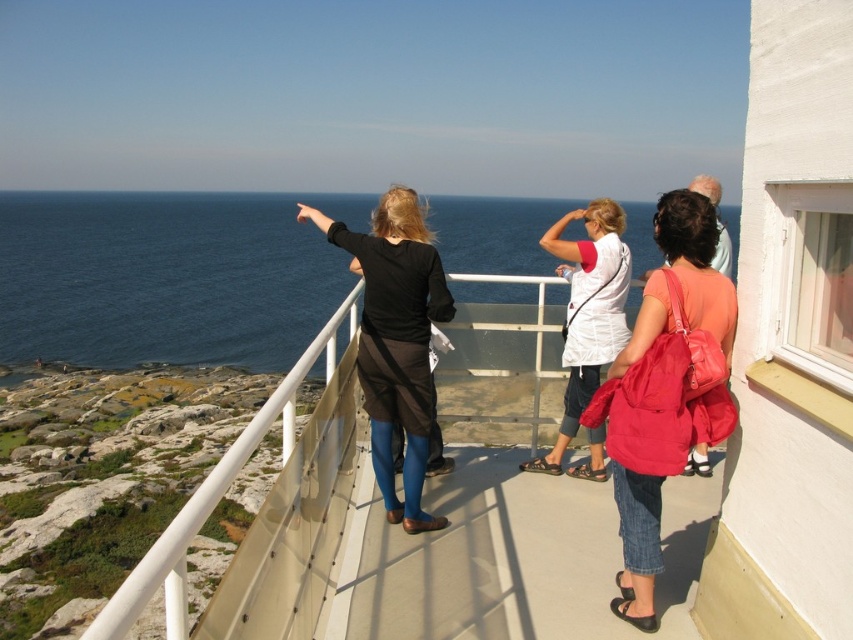
Between blue water at upper left and black matte skirt at center, which one is positioned higher?

blue water at upper left is above.

Is point (194, 330) less distant than point (407, 273)?

No, it is behind (407, 273).

Where is `blue water at upper left`? blue water at upper left is located at coordinates (166, 276).

Does denim jacket at lower right appear over black matte skirt at center?

No, denim jacket at lower right is not above black matte skirt at center.

Who is positioned more to the right, denim jacket at lower right or black matte skirt at center?

denim jacket at lower right is more to the right.

Is point (720, 365) closer to camera compared to point (393, 381)?

Yes, point (720, 365) is closer to viewer.

Find the location of a particular element. This screenshot has width=853, height=640. denim jacket at lower right is located at coordinates (665, 388).

Which is behind, point (352, 227) or point (582, 465)?

Point (352, 227)

Is blue water at upper left positioned behind white cotton shirt at center?

No, it is not.

Between point (155, 248) and point (567, 342), which one is positioned in front?

Positioned in front is point (567, 342).

Identify the location of blue water at upper left. (166, 276).